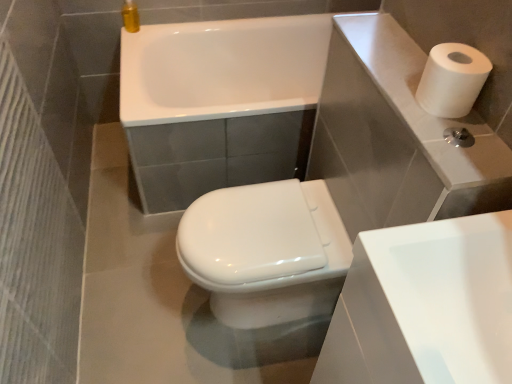
Question: Can you confirm if white glossy sink at lower right is positioned to the right of white glossy bidet at center?

Choices:
 (A) no
 (B) yes

Answer: (B)

Question: From a real-world perspective, is white glossy sink at lower right on white glossy bidet at center?

Choices:
 (A) no
 (B) yes

Answer: (B)

Question: Can you confirm if white glossy sink at lower right is shorter than white glossy bidet at center?

Choices:
 (A) no
 (B) yes

Answer: (A)

Question: Is white glossy sink at lower right outside white glossy bidet at center?

Choices:
 (A) yes
 (B) no

Answer: (A)

Question: Does white glossy sink at lower right have a greater height compared to white glossy bidet at center?

Choices:
 (A) yes
 (B) no

Answer: (A)

Question: Considering their positions, is white glossy bathtub at upper center located in front of or behind white glossy sink at lower right?

Choices:
 (A) front
 (B) behind

Answer: (B)

Question: Considering the positions of white glossy bathtub at upper center and white glossy sink at lower right in the image, is white glossy bathtub at upper center bigger or smaller than white glossy sink at lower right?

Choices:
 (A) small
 (B) big

Answer: (B)

Question: From the image's perspective, is white glossy bathtub at upper center above or below white glossy sink at lower right?

Choices:
 (A) above
 (B) below

Answer: (A)

Question: In terms of width, does white glossy bathtub at upper center look wider or thinner when compared to white glossy sink at lower right?

Choices:
 (A) wide
 (B) thin

Answer: (A)

Question: From the image's perspective, is white glossy bathtub at upper center above or below white matte paper towel at upper right?

Choices:
 (A) above
 (B) below

Answer: (A)

Question: From a real-world perspective, is white glossy bathtub at upper center above or below white matte paper towel at upper right?

Choices:
 (A) above
 (B) below

Answer: (B)

Question: In terms of size, does white glossy bathtub at upper center appear bigger or smaller than white matte paper towel at upper right?

Choices:
 (A) small
 (B) big

Answer: (B)

Question: Is white glossy bathtub at upper center in front of or behind white matte paper towel at upper right in the image?

Choices:
 (A) behind
 (B) front

Answer: (A)

Question: Is white glossy sink at lower right taller or shorter than white glossy bidet at center?

Choices:
 (A) short
 (B) tall

Answer: (B)

Question: Looking at the image, does white glossy sink at lower right seem bigger or smaller compared to white glossy bidet at center?

Choices:
 (A) big
 (B) small

Answer: (B)